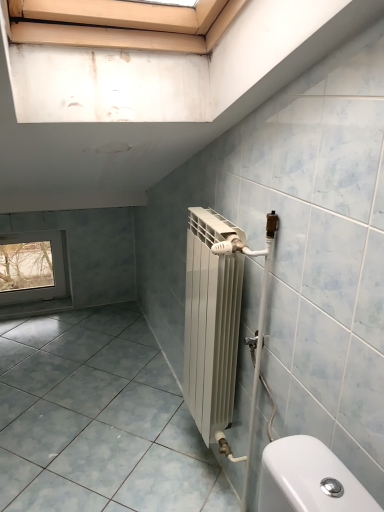
Question: From the image's perspective, is matte gray tile at lower left under transparent glass window at lower left?

Choices:
 (A) no
 (B) yes

Answer: (B)

Question: Is matte gray tile at lower left far from transparent glass window at lower left?

Choices:
 (A) no
 (B) yes

Answer: (B)

Question: Can you confirm if matte gray tile at lower left is taller than transparent glass window at lower left?

Choices:
 (A) no
 (B) yes

Answer: (A)

Question: Would you say matte gray tile at lower left is outside transparent glass window at lower left?

Choices:
 (A) no
 (B) yes

Answer: (B)

Question: From a real-world perspective, is matte gray tile at lower left physically above transparent glass window at lower left?

Choices:
 (A) no
 (B) yes

Answer: (A)

Question: Can you confirm if matte gray tile at lower left is positioned to the left of transparent glass window at lower left?

Choices:
 (A) no
 (B) yes

Answer: (A)

Question: Is transparent glass window at lower left touching matte gray tile at lower left?

Choices:
 (A) yes
 (B) no

Answer: (B)

Question: Is transparent glass window at lower left positioned behind matte gray tile at lower left?

Choices:
 (A) yes
 (B) no

Answer: (A)

Question: Would you say transparent glass window at lower left contains matte gray tile at lower left?

Choices:
 (A) no
 (B) yes

Answer: (A)

Question: Considering the relative sizes of transparent glass window at lower left and matte gray tile at lower left in the image provided, is transparent glass window at lower left bigger than matte gray tile at lower left?

Choices:
 (A) yes
 (B) no

Answer: (B)

Question: From a real-world perspective, is transparent glass window at lower left under matte gray tile at lower left?

Choices:
 (A) yes
 (B) no

Answer: (B)

Question: From a real-world perspective, is transparent glass window at lower left physically above matte gray tile at lower left?

Choices:
 (A) no
 (B) yes

Answer: (B)

Question: From a real-world perspective, relative to matte gray tile at lower left, is transparent glass window at lower left vertically above or below?

Choices:
 (A) below
 (B) above

Answer: (B)